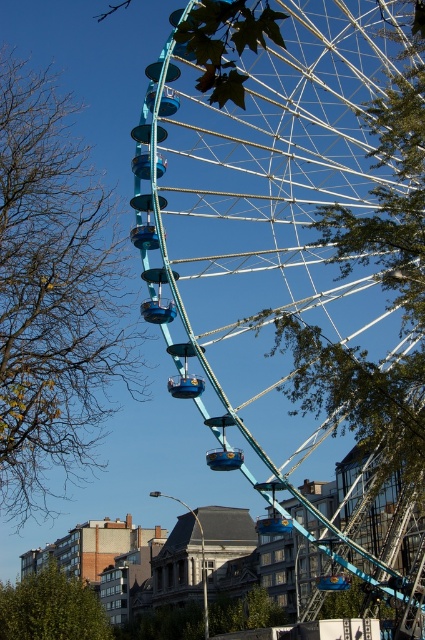
You are standing in a park and see the teal metallic ferris wheel at center and the green leafy tree at lower left. Which object appears larger in the image?

The teal metallic ferris wheel at center appears larger than the green leafy tree at lower left in the image.

You are standing in a park and want to take a photo of the teal metallic ferris wheel at center and the green leafy tree at left. If you want both to be fully visible in the frame, which object should you position closer to the camera to ensure they both fit?

You should position the green leafy tree at left closer to the camera because the teal metallic ferris wheel at center is wider than the green leafy tree at left, so moving the tree forward will help both fit in the frame.